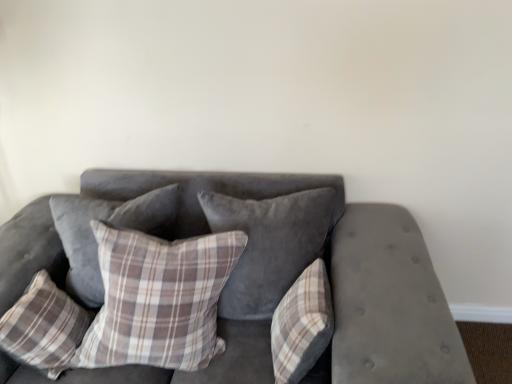
Question: In terms of width, does plaid fabric pillow at lower left, which is the first pillow from left to right, look wider or thinner when compared to plaid fabric pillow at center, which is counted as the 3th pillow, starting from the right?

Choices:
 (A) thin
 (B) wide

Answer: (A)

Question: Is plaid fabric pillow at lower left, acting as the fifth pillow starting from the right, taller or shorter than plaid fabric pillow at center, which is counted as the 3th pillow, starting from the right?

Choices:
 (A) short
 (B) tall

Answer: (A)

Question: Based on their relative distances, which object is nearer to the velvet gray couch at center?

Choices:
 (A) plaid fabric pillow at center, acting as the fourth pillow starting from the right
 (B) plaid fabric pillow at center, the fifth pillow positioned from the left
 (C) velvet gray pillow at center, which is the fourth pillow from left to right
 (D) plaid fabric pillow at lower left, which is the first pillow from left to right
 (E) plaid fabric pillow at center, which is counted as the 3th pillow, starting from the right

Answer: (C)

Question: Estimate the real-world distances between objects in this image. Which object is farther from the plaid fabric pillow at center, positioned as the 1th pillow in right-to-left order?

Choices:
 (A) velvet gray couch at center
 (B) plaid fabric pillow at lower left, which is the first pillow from left to right
 (C) velvet gray pillow at center, the 2th pillow in the right-to-left sequence
 (D) plaid fabric pillow at center, which appears as the 3th pillow when viewed from the left
 (E) plaid fabric pillow at center, acting as the fourth pillow starting from the right

Answer: (B)